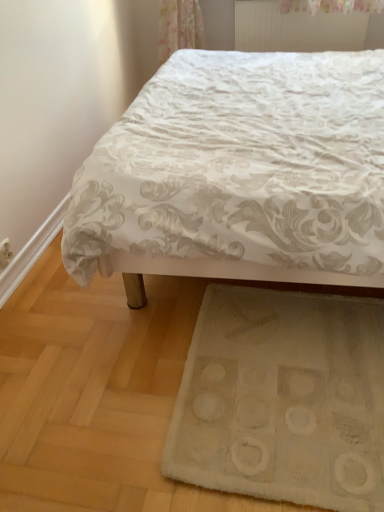
Where is `free point below white soft rug at lower center (from a real-world perspective)`? free point below white soft rug at lower center (from a real-world perspective) is located at coordinates (287, 407).